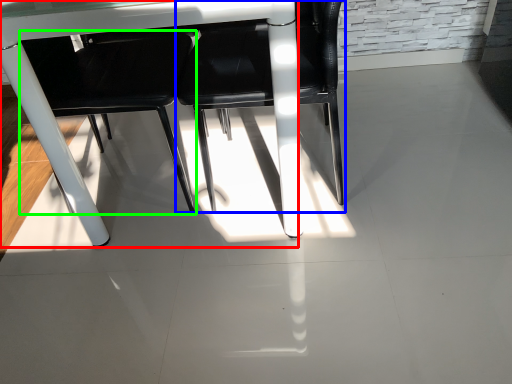
Question: Based on their relative distances, which object is nearer to table (highlighted by a red box)? Choose from chair (highlighted by a blue box) and chair (highlighted by a green box).

Choices:
 (A) chair
 (B) chair

Answer: (A)